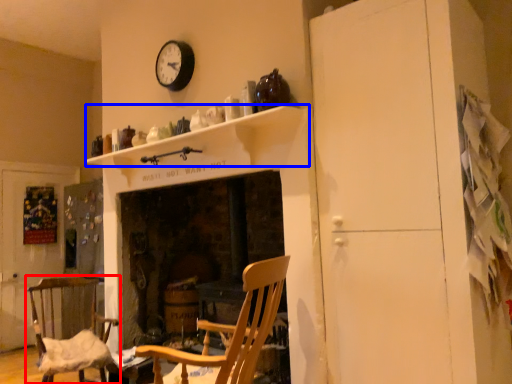
Question: Which point is further to the camera, chair (highlighted by a red box) or mantle (highlighted by a blue box)?

Choices:
 (A) chair
 (B) mantle

Answer: (A)